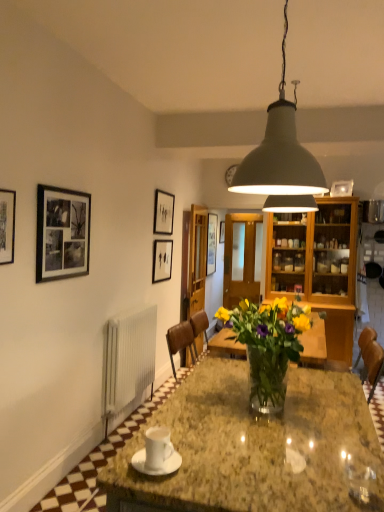
Question: From the image's perspective, is white glossy saucer at center above or below yellow matte vase at center?

Choices:
 (A) below
 (B) above

Answer: (A)

Question: Is white glossy saucer at center to the left or to the right of yellow matte vase at center in the image?

Choices:
 (A) left
 (B) right

Answer: (A)

Question: Estimate the real-world distances between objects in this image. Which object is farther from the black matte picture frame at upper left, which appears as the 4th picture frame when viewed from the back?

Choices:
 (A) clear glass vase at center
 (B) matte black picture frame at center, positioned as the second picture frame in back-to-front order
 (C) matte white picture frame at upper center, which is the 1th picture frame from right to left
 (D) matte black picture frame at upper center, positioned as the third picture frame in back-to-front order
 (E) matte gray lampshade at upper center

Answer: (C)

Question: Which is nearer to the black matte picture frame at upper left, arranged as the first picture frame when viewed from the left?

Choices:
 (A) matte black picture frame at upper center, arranged as the 2th picture frame when viewed from the front
 (B) matte white picture frame at upper center, marked as the 4th picture frame in a front-to-back arrangement
 (C) matte gray lampshade at upper center
 (D) clear glass vase at center
 (E) matte black picture frame at center, positioned as the third picture frame in front-to-back order

Answer: (C)